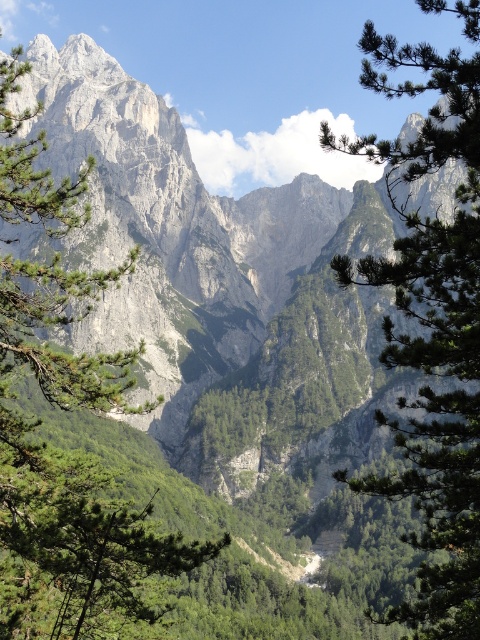
Is green leafy tree at left positioned behind green leafy tree at center?

Yes, green leafy tree at left is behind green leafy tree at center.

Which is in front, point (96, 605) or point (470, 568)?

Point (470, 568) is more forward.

This screenshot has height=640, width=480. What are the coordinates of `green leafy tree at left` in the screenshot? It's located at (72, 476).